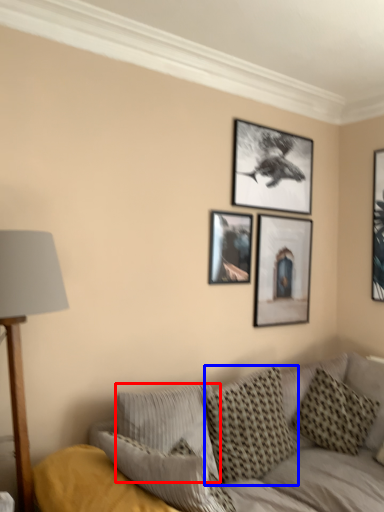
Question: Which point is closer to the camera, pillow (highlighted by a red box) or pillow (highlighted by a blue box)?

Choices:
 (A) pillow
 (B) pillow

Answer: (A)